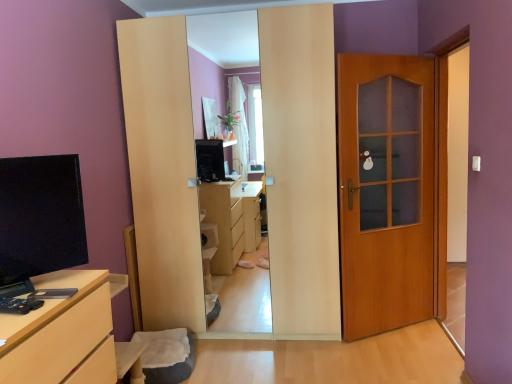
Question: Is wooden door at right in front of matte black tv at left?

Choices:
 (A) no
 (B) yes

Answer: (A)

Question: Is wooden door at right positioned behind matte black tv at left?

Choices:
 (A) yes
 (B) no

Answer: (A)

Question: Is wooden door at right turned away from matte black tv at left?

Choices:
 (A) yes
 (B) no

Answer: (B)

Question: Does wooden door at right appear on the right side of matte black tv at left?

Choices:
 (A) no
 (B) yes

Answer: (B)

Question: Does wooden door at right have a lesser height compared to matte black tv at left?

Choices:
 (A) no
 (B) yes

Answer: (A)

Question: Based on their sizes in the image, would you say matte black tv at left is bigger or smaller than wooden door at right?

Choices:
 (A) big
 (B) small

Answer: (B)

Question: Is matte black tv at left spatially inside wooden door at right, or outside of it?

Choices:
 (A) outside
 (B) inside

Answer: (A)

Question: In the image, is matte black tv at left positioned in front of or behind wooden door at right?

Choices:
 (A) front
 (B) behind

Answer: (A)

Question: Looking at their shapes, would you say matte black tv at left is wider or thinner than wooden door at right?

Choices:
 (A) wide
 (B) thin

Answer: (A)

Question: Considering the relative positions of matte wood chest of drawers at lower left and wooden door at right in the image provided, is matte wood chest of drawers at lower left to the left or to the right of wooden door at right?

Choices:
 (A) right
 (B) left

Answer: (B)

Question: From a real-world perspective, relative to wooden door at right, is matte wood chest of drawers at lower left vertically above or below?

Choices:
 (A) above
 (B) below

Answer: (B)

Question: Considering the positions of point (64, 374) and point (351, 127), is point (64, 374) closer or farther from the camera than point (351, 127)?

Choices:
 (A) farther
 (B) closer

Answer: (B)

Question: In terms of height, does matte wood chest of drawers at lower left look taller or shorter compared to wooden door at right?

Choices:
 (A) tall
 (B) short

Answer: (B)

Question: From the image's perspective, relative to matte wood chest of drawers at lower left, is wooden door at right above or below?

Choices:
 (A) below
 (B) above

Answer: (B)

Question: Is point (415, 147) positioned closer to the camera than point (91, 294)?

Choices:
 (A) closer
 (B) farther

Answer: (B)